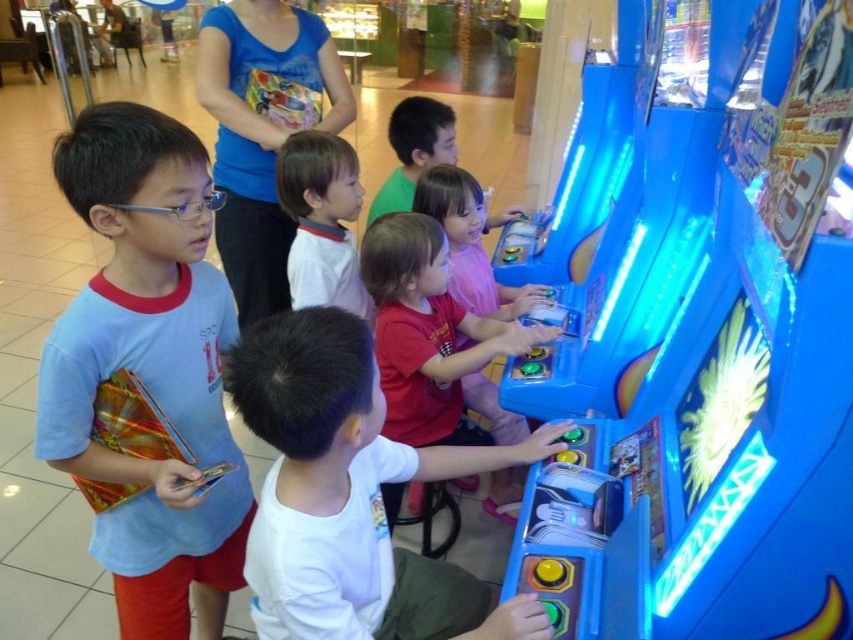
Question: Among these objects, which one is nearest to the camera?

Choices:
 (A) smooth white shirt at center
 (B) matte red shirt at center

Answer: (B)

Question: Can you confirm if light blue cotton shirt at left is thinner than smooth white shirt at center?

Choices:
 (A) no
 (B) yes

Answer: (A)

Question: Which of the following is the closest to the observer?

Choices:
 (A) white matte shirt at center
 (B) matte red shirt at center
 (C) smooth white shirt at center

Answer: (A)

Question: Can you confirm if white matte shirt at center is thinner than smooth white shirt at center?

Choices:
 (A) yes
 (B) no

Answer: (B)

Question: Considering the relative positions of white matte shirt at center and matte red shirt at center in the image provided, where is white matte shirt at center located with respect to matte red shirt at center?

Choices:
 (A) left
 (B) right

Answer: (A)

Question: Which point is farther to the camera?

Choices:
 (A) light blue cotton shirt at left
 (B) white matte shirt at center

Answer: (A)